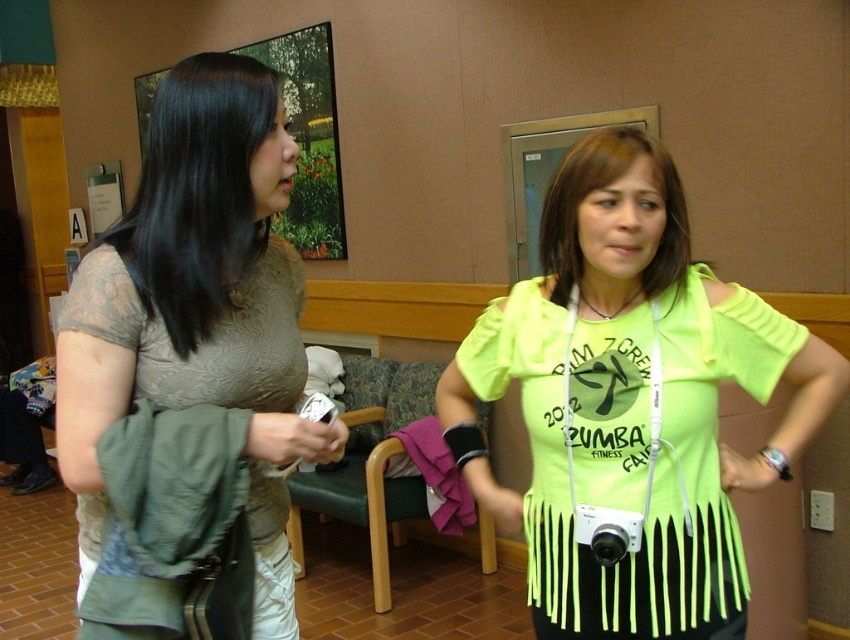
Question: Where is neon yellow fabric shirt at center located in relation to matte beige blouse at upper left in the image?

Choices:
 (A) left
 (B) right

Answer: (B)

Question: Can you confirm if neon yellow fabric shirt at center is wider than matte beige blouse at upper left?

Choices:
 (A) yes
 (B) no

Answer: (A)

Question: Which point is closer to the camera?

Choices:
 (A) neon yellow fabric shirt at center
 (B) matte beige blouse at upper left

Answer: (B)

Question: Does neon yellow fabric shirt at center appear under matte beige blouse at upper left?

Choices:
 (A) yes
 (B) no

Answer: (A)

Question: Which object is farther from the camera taking this photo?

Choices:
 (A) neon yellow fabric shirt at center
 (B) matte beige blouse at upper left

Answer: (A)